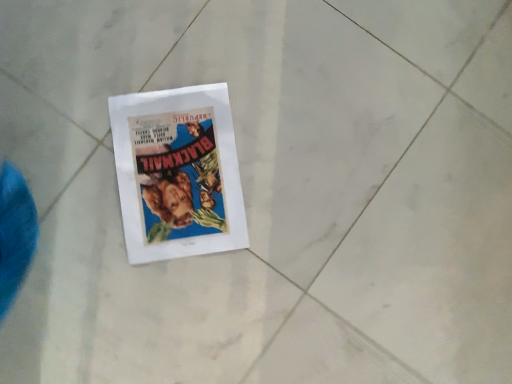
You are a GUI agent. You are given a task and a screenshot of the screen. Output one action in this format:
    pyautogui.click(x=<x>, y=<y>)
    Task: Click on the matte paper poster at center
    
    Given the screenshot: What is the action you would take?
    pyautogui.click(x=178, y=173)

What do you see at coordinates (178, 173) in the screenshot? This screenshot has width=512, height=384. I see `matte paper poster at center` at bounding box center [178, 173].

At what (x,y) coordinates should I click in order to perform the action: click on matte paper poster at center. Please return your answer as a coordinate pair (x, y). Looking at the image, I should click on (178, 173).